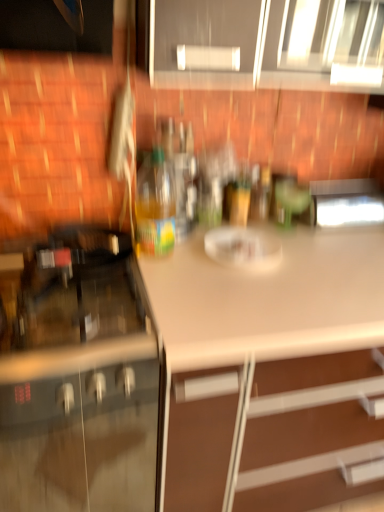
Question: Is matte black oven at left, the first cabinetry in the left-to-right sequence, bigger or smaller than translucent plastic bottle at center?

Choices:
 (A) small
 (B) big

Answer: (B)

Question: Which is correct: matte black oven at left, the first cabinetry in the left-to-right sequence, is inside translucent plastic bottle at center, or outside of it?

Choices:
 (A) inside
 (B) outside

Answer: (B)

Question: Which of these objects is positioned closest to the matte black oven at left, the second cabinetry when ordered from right to left?

Choices:
 (A) metallic stainless steel microwave at upper right
 (B) matte gray cabinets at upper center, marked as the 2th cabinetry in a bottom-to-top arrangement
 (C) translucent plastic bottle at center
 (D) white matte countertop at center

Answer: (D)

Question: Estimate the real-world distances between objects in this image. Which object is farther from the white matte countertop at center?

Choices:
 (A) translucent plastic bottle at center
 (B) matte gray cabinets at upper center, which appears as the 1th cabinetry when viewed from the right
 (C) matte black oven at left, acting as the 1th cabinetry starting from the bottom
 (D) metallic stainless steel microwave at upper right

Answer: (B)